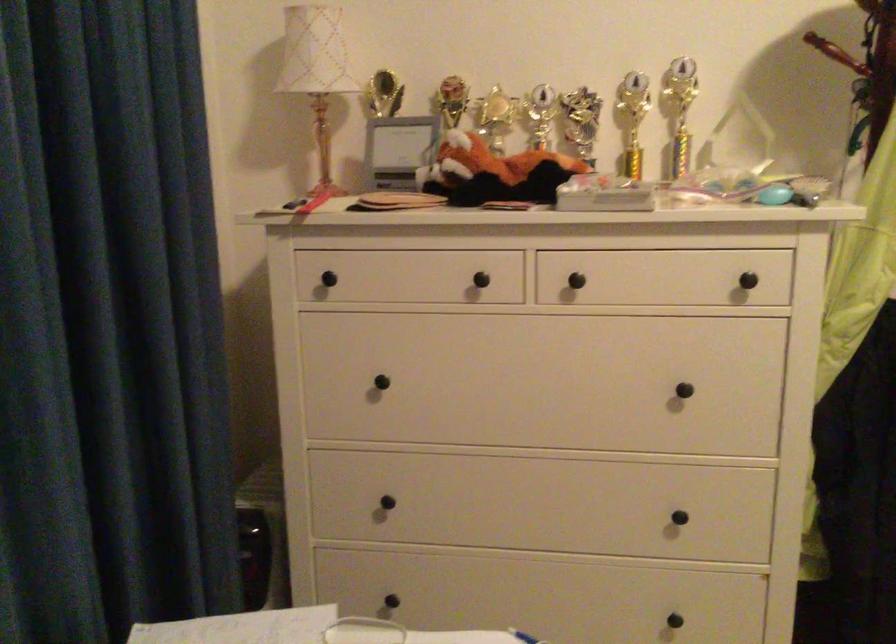
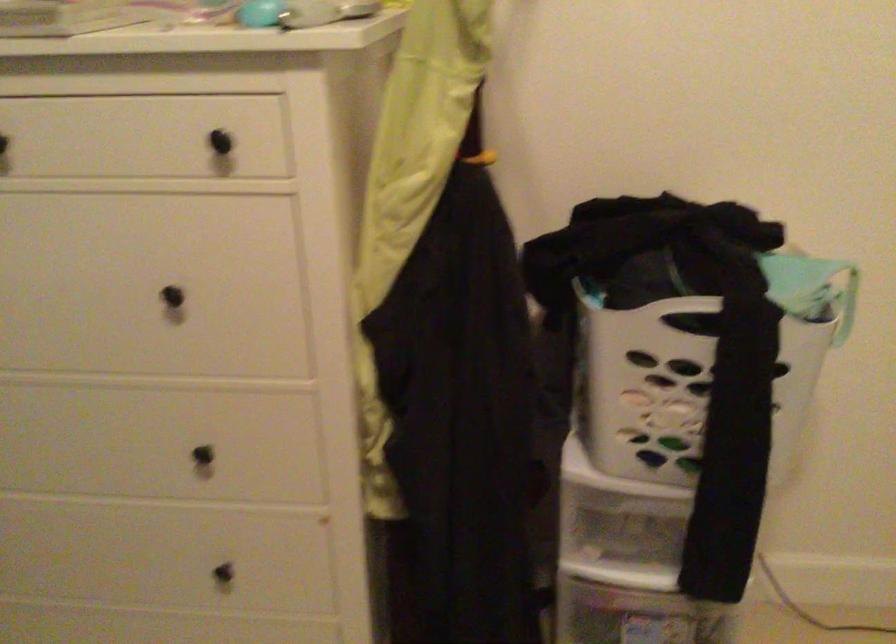
The point at (x=682, y=527) is marked in the first image. Where is the corresponding point in the second image?

(213, 462)